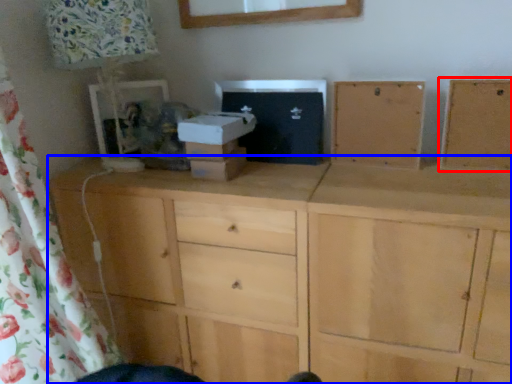
Question: Among these objects, which one is nearest to the camera, cabinetry (highlighted by a red box) or chest of drawers (highlighted by a blue box)?

Choices:
 (A) cabinetry
 (B) chest of drawers

Answer: (B)